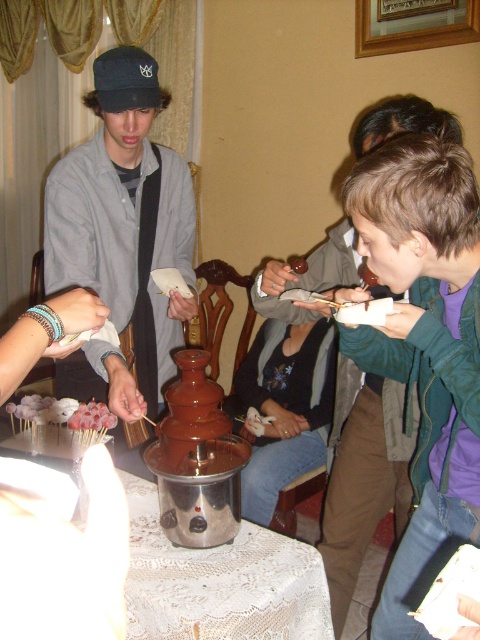
You are planning to take a photo of the green matte jacket at upper right and the white sugary skewers at lower left. Which object should you focus on first if you want to capture both in a single frame without moving the camera?

You should focus on the green matte jacket at upper right first because it is larger in size than the white sugary skewers at lower left, ensuring it is properly in focus before adjusting for the smaller object.

You are at a chocolate fountain party and want to grab a drink from the table. The green matte jacket at upper right and the matte black cap at center are blocking your path. Which direction should you move to avoid them?

The green matte jacket at upper right is positioned on the right side of matte black cap at center. To avoid both, move to the left side of the matte black cap at center, away from the green matte jacket at upper right.

You are at a chocolate fountain event and want to choose between the matte black cap at center and the white sugary skewers at lower left. Which one is narrower?

The matte black cap at center is narrower than the white sugary skewers at lower left.